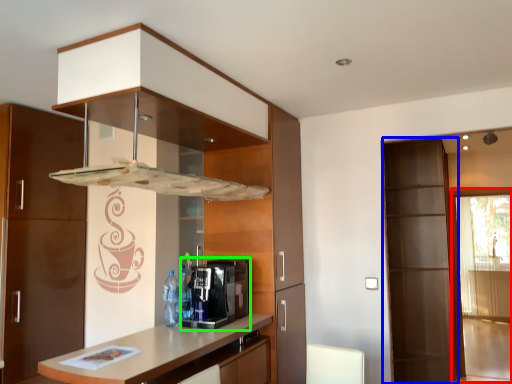
Question: Considering the real-world distances, which object is closest to screen door (highlighted by a red box)? screen door (highlighted by a blue box) or coffee machine (highlighted by a green box).

Choices:
 (A) screen door
 (B) coffee machine

Answer: (A)